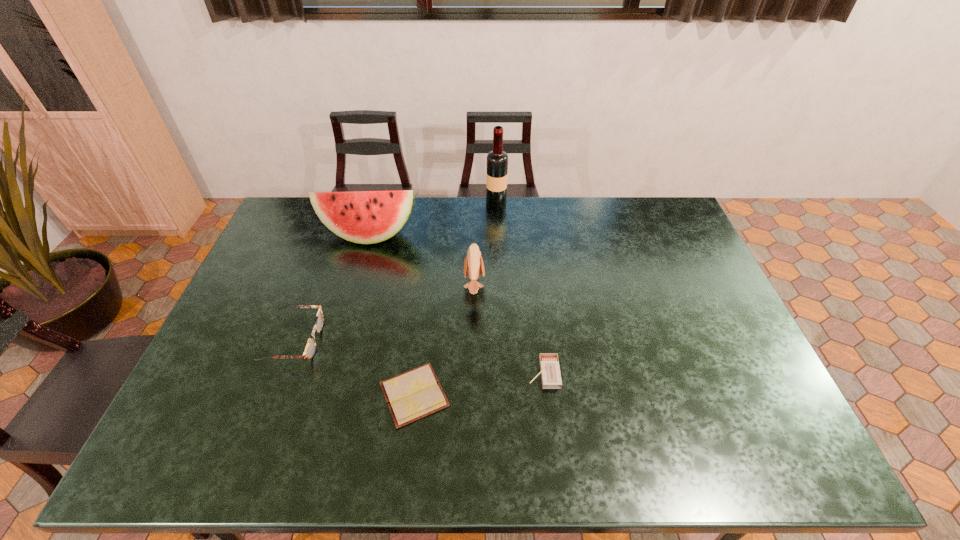
Identify the location of vacant space positioned 0.050m on the front of the tallest object. (496, 219).

At what (x,y) coordinates should I click in order to perform the action: click on free spot located on the outer rind of the watermelon. Please return your answer as a coordinate pair (x, y). The image size is (960, 540). Looking at the image, I should click on (358, 275).

Locate an element on the screen. This screenshot has width=960, height=540. vacant space located 0.160m at the beak of the third tallest object is located at coordinates (536, 286).

Where is `vacant space situated on the frame of the fourth tallest object`? Image resolution: width=960 pixels, height=540 pixels. vacant space situated on the frame of the fourth tallest object is located at coordinates (413, 341).

The width and height of the screenshot is (960, 540). I want to click on free space located 0.060m on the striking surface of the second shortest object, so click(506, 373).

The height and width of the screenshot is (540, 960). I want to click on free space located 0.050m on the striking surface of the second shortest object, so click(510, 373).

This screenshot has width=960, height=540. Identify the location of vacant region located on the striking surface of the second shortest object. (506, 373).

Find the location of a particular element. free space located on the back of the shortest object is located at coordinates (428, 276).

The width and height of the screenshot is (960, 540). What are the coordinates of `wine bottle present at the far edge` in the screenshot? It's located at (497, 160).

You are a GUI agent. You are given a task and a screenshot of the screen. Output one action in this format:
    pyautogui.click(x=<x>, y=<y>)
    Task: Click on the watermelon present at the far edge
    The width and height of the screenshot is (960, 540).
    Given the screenshot: What is the action you would take?
    click(366, 217)